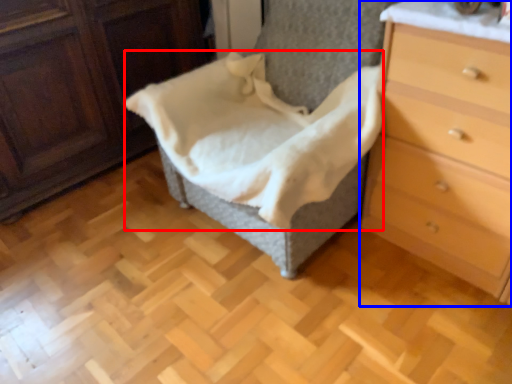
Question: Which object is closer to the camera taking this photo, blanket (highlighted by a red box) or chest of drawers (highlighted by a blue box)?

Choices:
 (A) blanket
 (B) chest of drawers

Answer: (B)